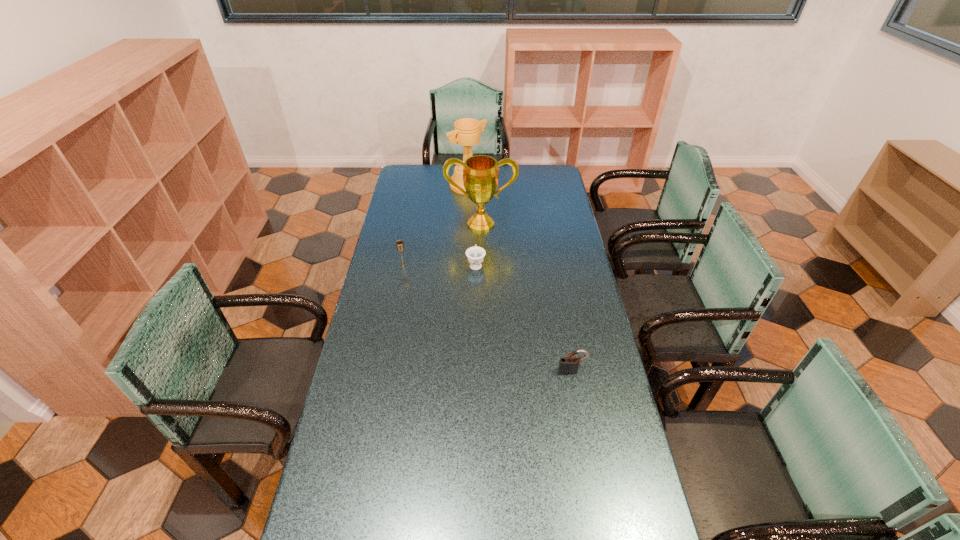
Locate an element on the screen. The image size is (960, 540). vacant space situated 0.080m on the side of the shortest object with the handle is located at coordinates (476, 245).

The width and height of the screenshot is (960, 540). I want to click on vacant area located on the side of the shortest object with the handle, so click(476, 238).

Find the location of a particular element. vacant region located on the side of the shortest object with the handle is located at coordinates (476, 215).

Find the location of a particular element. This screenshot has width=960, height=540. object that is at the far edge is located at coordinates (466, 133).

Find the location of a particular element. The width and height of the screenshot is (960, 540). object located in the left edge section of the desktop is located at coordinates (399, 244).

Where is `object situated at the right edge`? This screenshot has width=960, height=540. object situated at the right edge is located at coordinates (568, 365).

The image size is (960, 540). What are the coordinates of `free space at the left edge` in the screenshot? It's located at (343, 472).

In order to click on vacant area at the right edge in this screenshot , I will do `click(581, 297)`.

This screenshot has width=960, height=540. I want to click on free space at the far left corner, so click(398, 177).

Find the location of a particular element. free region at the far right corner is located at coordinates (563, 181).